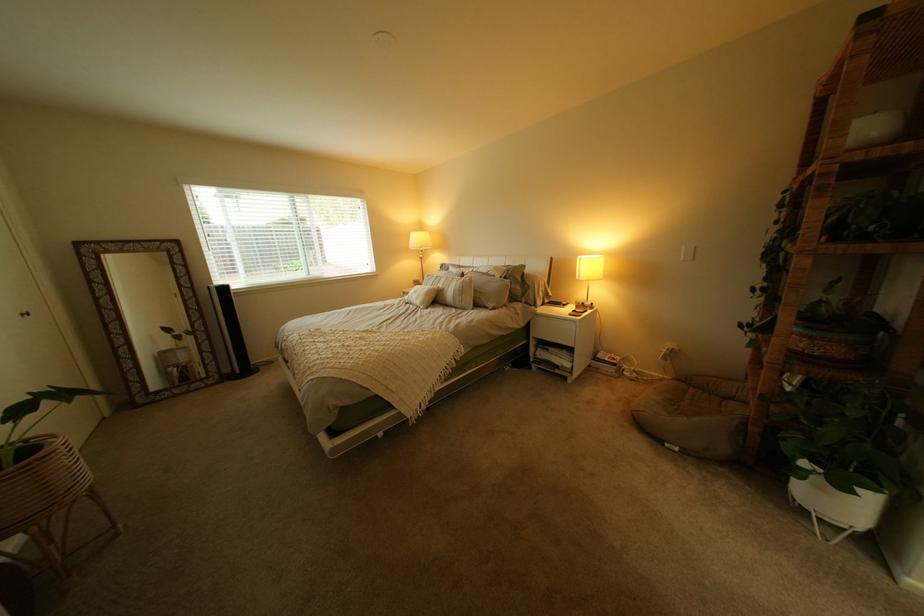
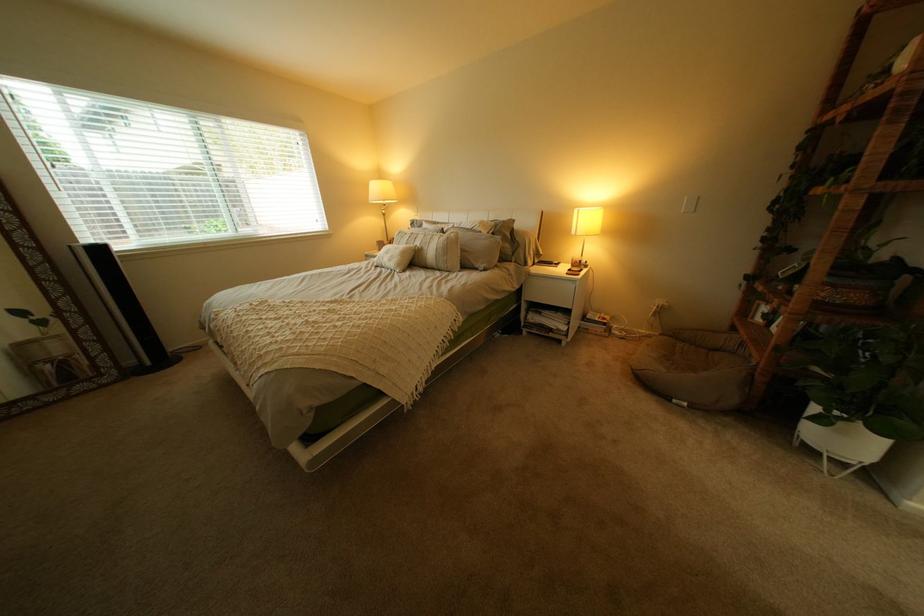
In a continuous first-person perspective shot, in which direction is the camera moving?

The movement direction of the cameraman is left, forward.